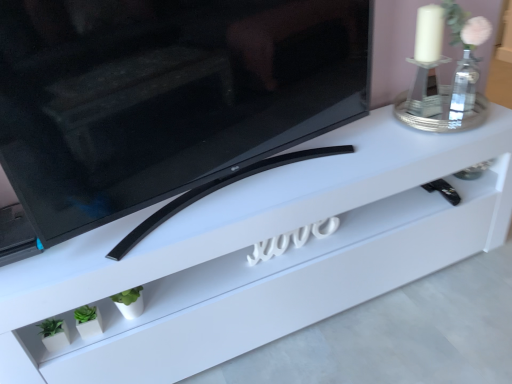
Question: Does white matte planter at lower left have a larger size compared to black glossy tv at center?

Choices:
 (A) no
 (B) yes

Answer: (A)

Question: Considering the relative positions of white matte planter at lower left and black glossy tv at center in the image provided, is white matte planter at lower left behind black glossy tv at center?

Choices:
 (A) no
 (B) yes

Answer: (B)

Question: Is white matte planter at lower left thinner than black glossy tv at center?

Choices:
 (A) yes
 (B) no

Answer: (A)

Question: From a real-world perspective, is white matte planter at lower left under black glossy tv at center?

Choices:
 (A) yes
 (B) no

Answer: (A)

Question: Is white matte planter at lower left wider than black glossy tv at center?

Choices:
 (A) yes
 (B) no

Answer: (B)

Question: From the image's perspective, is white matte planter at lower left positioned above or below white glass candle holder at upper right?

Choices:
 (A) above
 (B) below

Answer: (B)

Question: Considering the positions of white matte planter at lower left and white glass candle holder at upper right in the image, is white matte planter at lower left bigger or smaller than white glass candle holder at upper right?

Choices:
 (A) small
 (B) big

Answer: (A)

Question: Is white matte planter at lower left in front of or behind white glass candle holder at upper right in the image?

Choices:
 (A) front
 (B) behind

Answer: (A)

Question: From their relative heights in the image, would you say white matte planter at lower left is taller or shorter than white glass candle holder at upper right?

Choices:
 (A) short
 (B) tall

Answer: (A)

Question: Considering the positions of white matte planter at lower left and white glossy tv stand at center in the image, is white matte planter at lower left wider or thinner than white glossy tv stand at center?

Choices:
 (A) thin
 (B) wide

Answer: (A)

Question: Is white matte planter at lower left taller or shorter than white glossy tv stand at center?

Choices:
 (A) tall
 (B) short

Answer: (B)

Question: Choose the correct answer: Is white matte planter at lower left inside white glossy tv stand at center or outside it?

Choices:
 (A) outside
 (B) inside

Answer: (B)

Question: From a real-world perspective, relative to white glossy tv stand at center, is white matte planter at lower left vertically above or below?

Choices:
 (A) below
 (B) above

Answer: (B)

Question: From the image's perspective, is white matte planter at lower left positioned above or below black glossy tv at center?

Choices:
 (A) above
 (B) below

Answer: (B)

Question: Considering the positions of point (93, 309) and point (168, 177), is point (93, 309) closer or farther from the camera than point (168, 177)?

Choices:
 (A) closer
 (B) farther

Answer: (B)